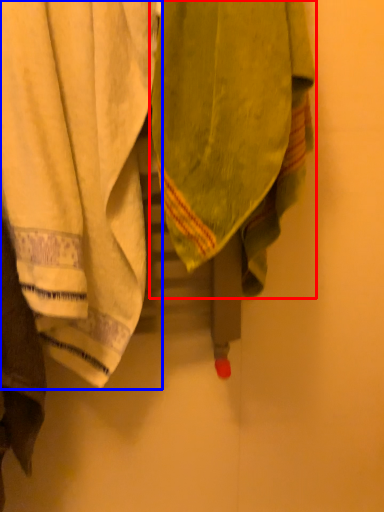
Question: Which point is closer to the camera, towel (highlighted by a red box) or towel (highlighted by a blue box)?

Choices:
 (A) towel
 (B) towel

Answer: (A)